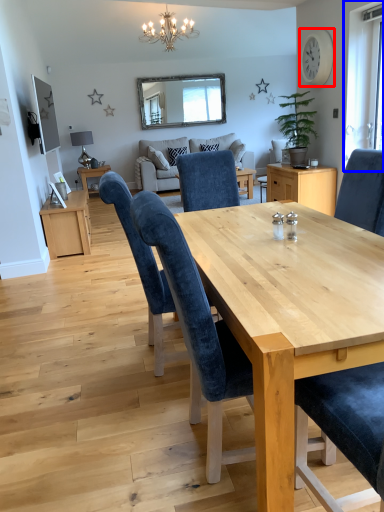
Question: Which object appears farthest to the camera in this image, clock (highlighted by a red box) or window (highlighted by a blue box)?

Choices:
 (A) clock
 (B) window

Answer: (A)